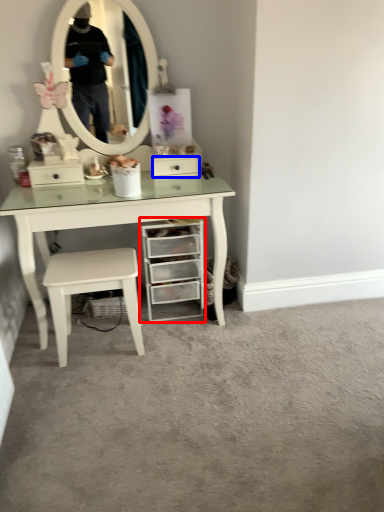
Question: Among these objects, which one is nearest to the camera, chest of drawers (highlighted by a red box) or drawer (highlighted by a blue box)?

Choices:
 (A) chest of drawers
 (B) drawer

Answer: (A)